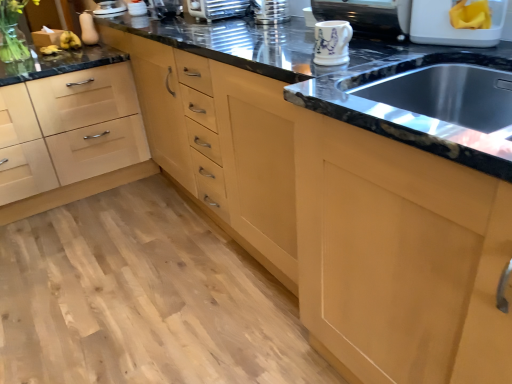
Identify the location of vacant space positioned to the left of porcelain mug at upper center, which is counted as the sixth appliance, starting from the left. (300, 66).